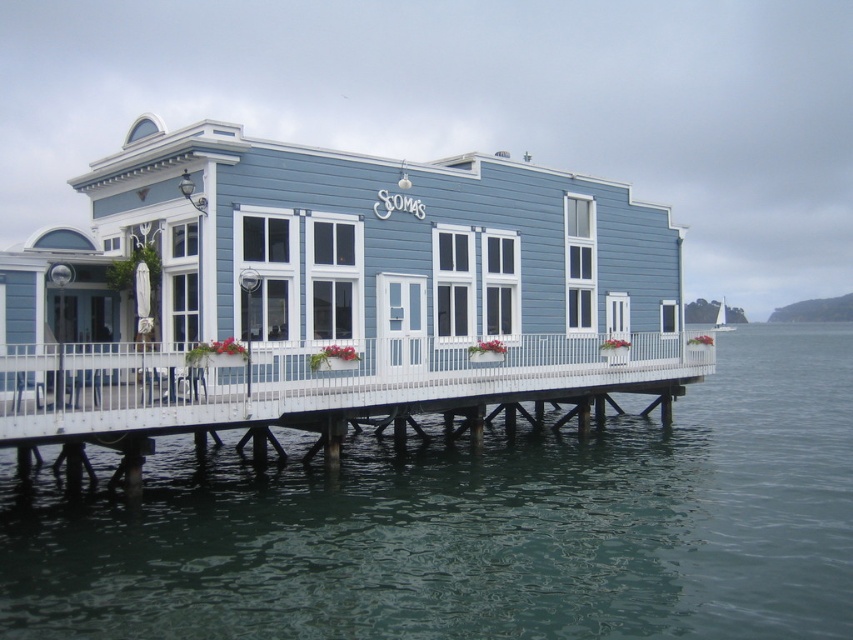
Does transparent water at lower center have a greater width compared to white wooden dock at lower center?

Yes, transparent water at lower center is wider than white wooden dock at lower center.

Does point (78, 582) come closer to viewer compared to point (560, 352)?

Yes, it is.

Identify the location of transparent water at lower center. This screenshot has width=853, height=640. (479, 525).